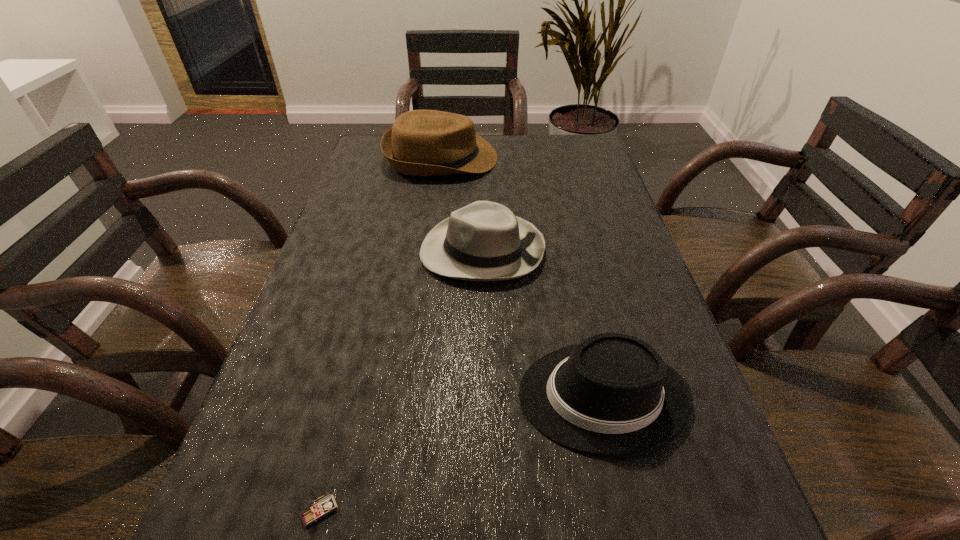
Locate an element on the screen. the farthest fedora is located at coordinates (421, 142).

Identify the location of the second farthest fedora. The height and width of the screenshot is (540, 960). (484, 241).

Where is `the nearest fedora`? the nearest fedora is located at coordinates (612, 395).

Image resolution: width=960 pixels, height=540 pixels. I want to click on the shortest object, so click(325, 506).

Find the location of a particular element. The image size is (960, 540). matchbox is located at coordinates (325, 506).

Identify the location of vacant space situated on the front-facing side of the farthest fedora. The width and height of the screenshot is (960, 540). (564, 158).

The width and height of the screenshot is (960, 540). What are the coordinates of `vacant space located 0.050m on the front-facing side of the second nearest fedora` in the screenshot? It's located at (398, 251).

Locate an element on the screen. Image resolution: width=960 pixels, height=540 pixels. blank area located 0.210m on the front-facing side of the second nearest fedora is located at coordinates (328, 251).

Locate an element on the screen. free space located 0.230m on the front-facing side of the second nearest fedora is located at coordinates [320, 251].

Find the location of a particular element. blank space located 0.140m on the front-facing side of the third farthest object is located at coordinates (436, 396).